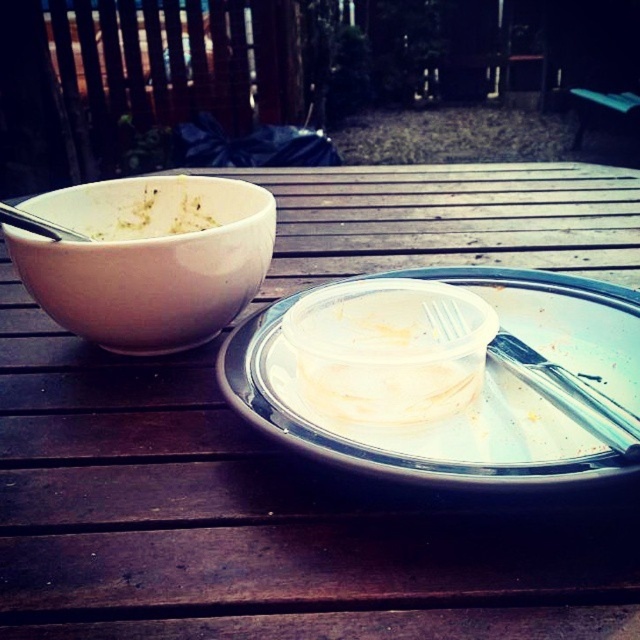
Looking at this image, between clear plastic container at center and white creamy pasta at left, which one appears on the right side from the viewer's perspective?

clear plastic container at center

Does clear plastic container at center appear under white creamy pasta at left?

Indeed, clear plastic container at center is positioned under white creamy pasta at left.

Is point (616, 358) closer to camera compared to point (152, 209)?

That is True.

Locate an element on the screen. clear plastic container at center is located at coordinates (413, 428).

Is point (173, 484) more distant than point (424, 305)?

No.

Where is `wooden table at center`? wooden table at center is located at coordinates (253, 522).

What do you see at coordinates (253, 522) in the screenshot? Image resolution: width=640 pixels, height=640 pixels. I see `wooden table at center` at bounding box center [253, 522].

The image size is (640, 640). In order to click on wooden table at center in this screenshot , I will do `click(253, 522)`.

Is point (580, 394) closer to camera compared to point (118, 221)?

Yes, point (580, 394) is in front of point (118, 221).

You are a GUI agent. You are given a task and a screenshot of the screen. Output one action in this format:
    pyautogui.click(x=<x>, y=<y>)
    Task: Click on the metallic silver fork at center
    Image resolution: width=640 pixels, height=640 pixels.
    Given the screenshot: What is the action you would take?
    pos(568,394)